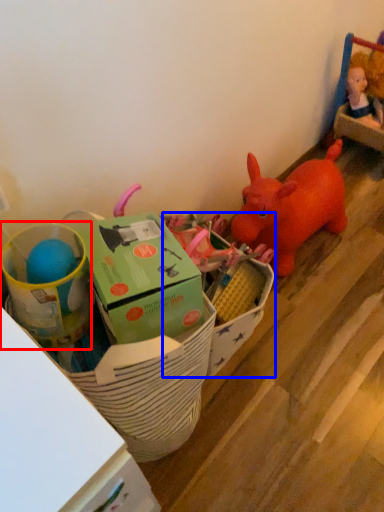
Question: Which object is further to the camera taking this photo, toy (highlighted by a red box) or storage box (highlighted by a blue box)?

Choices:
 (A) toy
 (B) storage box

Answer: (B)